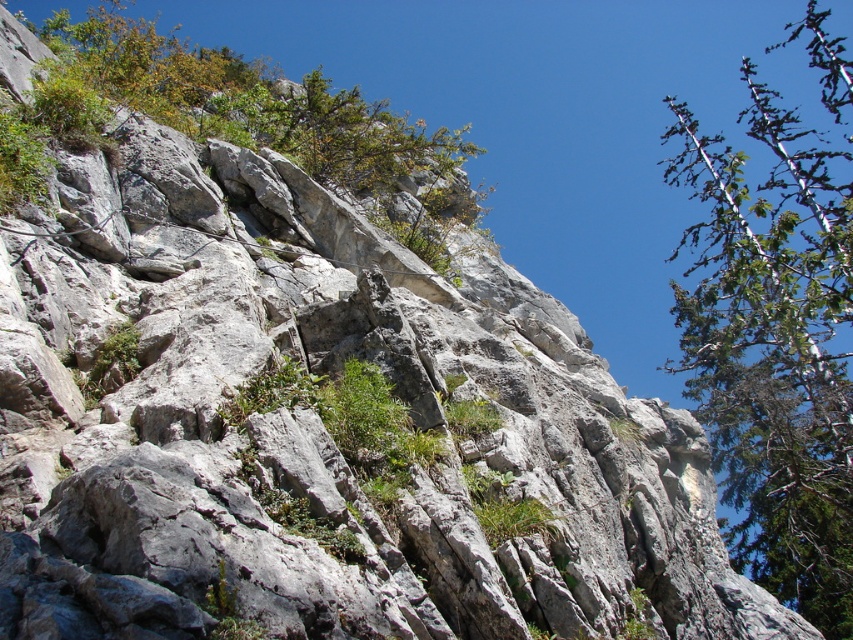
Can you confirm if green leafy tree at upper right is positioned to the right of green leafy tree at upper left?

Indeed, green leafy tree at upper right is positioned on the right side of green leafy tree at upper left.

Is green leafy tree at upper right closer to camera compared to green leafy tree at upper left?

No, it is behind green leafy tree at upper left.

Image resolution: width=853 pixels, height=640 pixels. I want to click on green leafy tree at upper right, so click(776, 332).